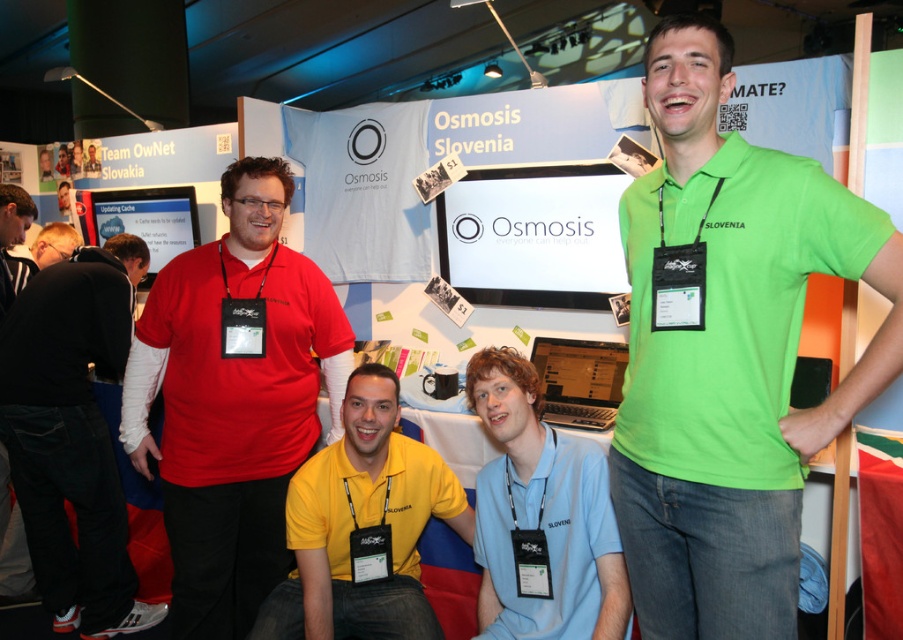
You are a photographer at the event and want to capture a photo of both the matte red shirt at center and the yellow matte shirt at center. Since you can only focus on one person at a time, which shirt should you focus on to ensure the other is still in the background?

You should focus on the matte red shirt at center because it is closer to the viewer, allowing the yellow matte shirt at center to remain in the background.

You are at the tech event and want to take a photo of both the point at coordinates point (233, 298) and the point at coordinates point (606, 579). Which point should you focus on first to ensure both are in focus?

You should focus on point (233, 298) first because it is closer to the camera than point (606, 579). This ensures the camera can adjust the focus to capture both points clearly.